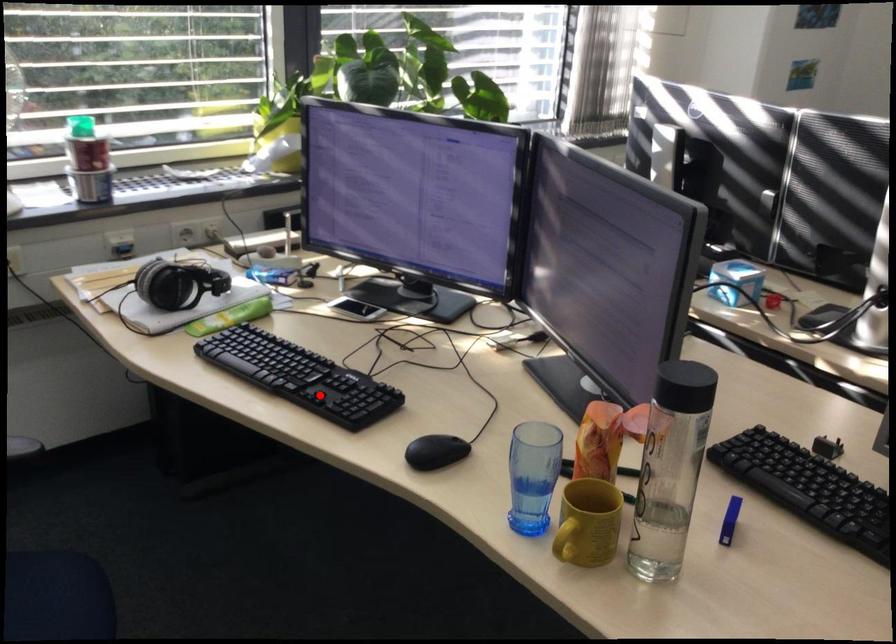
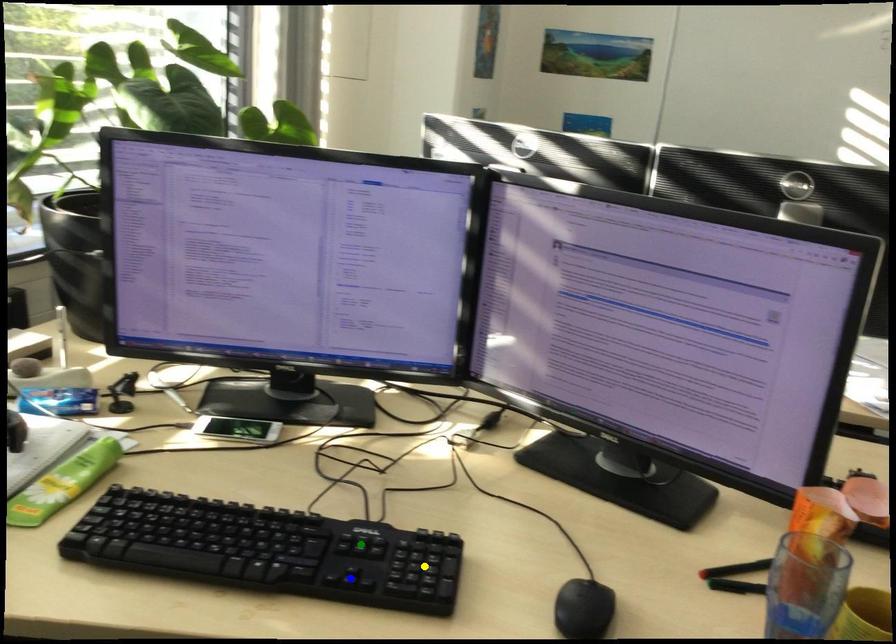
Question: I am providing you with two images of the same scene from different viewpoints. A red point is marked on the first image. You are given multiple points on the second image. Which point in image 2 represents the same 3d spot as the red point in image 1?

Choices:
 (A) blue point
 (B) green point
 (C) yellow point

Answer: (A)